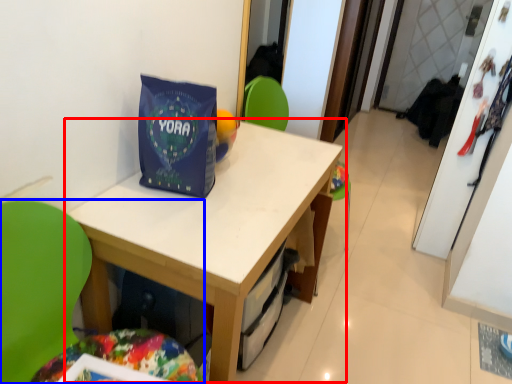
Question: Which point is closer to the camera, table (highlighted by a red box) or chair (highlighted by a blue box)?

Choices:
 (A) table
 (B) chair

Answer: (B)